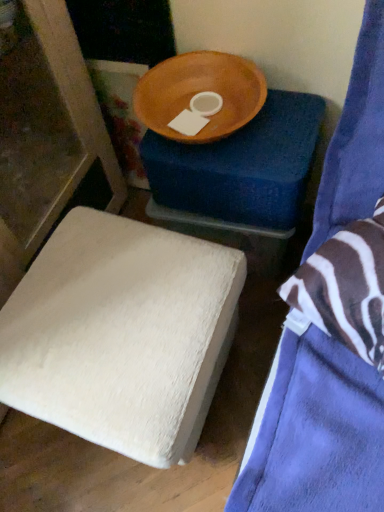
Question: Can you see wooden bowl at upper center touching blue fabric bed at upper right, placed as the 3th furniture when sorted from back to front?

Choices:
 (A) yes
 (B) no

Answer: (B)

Question: Considering the relative sizes of wooden bowl at upper center and blue fabric bed at upper right, placed as the 3th furniture when sorted from back to front, in the image provided, is wooden bowl at upper center shorter than blue fabric bed at upper right, placed as the 3th furniture when sorted from back to front,?

Choices:
 (A) no
 (B) yes

Answer: (B)

Question: Is wooden bowl at upper center surrounding blue fabric bed at upper right, acting as the 1th furniture starting from the front?

Choices:
 (A) yes
 (B) no

Answer: (B)

Question: Is wooden bowl at upper center oriented away from blue fabric bed at upper right, acting as the 1th furniture starting from the front?

Choices:
 (A) no
 (B) yes

Answer: (A)

Question: Is wooden bowl at upper center wider than blue fabric bed at upper right, placed as the 3th furniture when sorted from back to front?

Choices:
 (A) no
 (B) yes

Answer: (A)

Question: Is white fuzzy ottoman at lower left, which is counted as the second furniture, starting from the front, taller or shorter than wooden bowl at upper center, arranged as the third furniture when viewed from the front?

Choices:
 (A) tall
 (B) short

Answer: (B)

Question: From a real-world perspective, is white fuzzy ottoman at lower left, which is counted as the second furniture, starting from the front, physically located above or below wooden bowl at upper center, arranged as the third furniture when viewed from the front?

Choices:
 (A) above
 (B) below

Answer: (A)

Question: Is white fuzzy ottoman at lower left, which is the second furniture from back to front, in front of or behind wooden bowl at upper center, which ranks as the first furniture in back-to-front order, in the image?

Choices:
 (A) front
 (B) behind

Answer: (A)

Question: Is white fuzzy ottoman at lower left, which is counted as the second furniture, starting from the front, bigger or smaller than wooden bowl at upper center, which ranks as the first furniture in back-to-front order?

Choices:
 (A) small
 (B) big

Answer: (B)

Question: Visually, is wooden bowl at upper center positioned to the left or to the right of white fuzzy ottoman at lower left, which is the second furniture from back to front?

Choices:
 (A) left
 (B) right

Answer: (B)

Question: Looking at their shapes, would you say wooden bowl at upper center is wider or thinner than white fuzzy ottoman at lower left, which is the second furniture from back to front?

Choices:
 (A) thin
 (B) wide

Answer: (A)

Question: From a real-world perspective, is wooden bowl at upper center physically located above or below white fuzzy ottoman at lower left, which is counted as the second furniture, starting from the front?

Choices:
 (A) below
 (B) above

Answer: (B)

Question: Considering their positions, is wooden bowl at upper center located in front of or behind white fuzzy ottoman at lower left, which is the second furniture from back to front?

Choices:
 (A) front
 (B) behind

Answer: (B)

Question: In terms of size, does wooden bowl at upper center appear bigger or smaller than wooden bowl at upper center, which ranks as the first furniture in back-to-front order?

Choices:
 (A) small
 (B) big

Answer: (A)

Question: From a real-world perspective, is wooden bowl at upper center physically located above or below wooden bowl at upper center, which ranks as the first furniture in back-to-front order?

Choices:
 (A) above
 (B) below

Answer: (A)